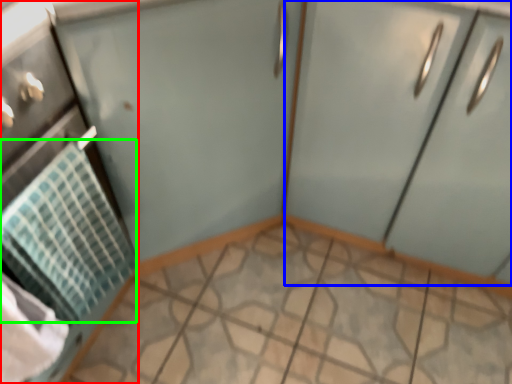
Question: Which object is the closest to the appliance (highlighted by a red box)? Choose among these: cabinetry (highlighted by a blue box) or blanket (highlighted by a green box).

Choices:
 (A) cabinetry
 (B) blanket

Answer: (B)